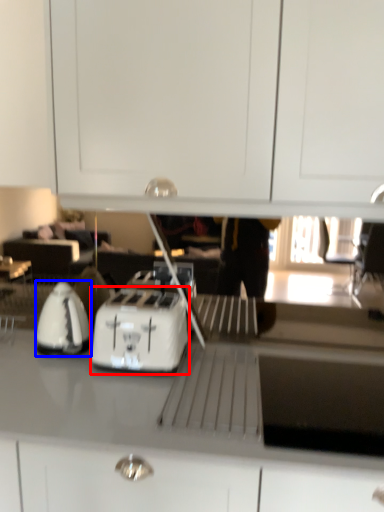
Question: Among these objects, which one is farthest to the camera, kitchen appliance (highlighted by a red box) or home appliance (highlighted by a blue box)?

Choices:
 (A) kitchen appliance
 (B) home appliance

Answer: (B)